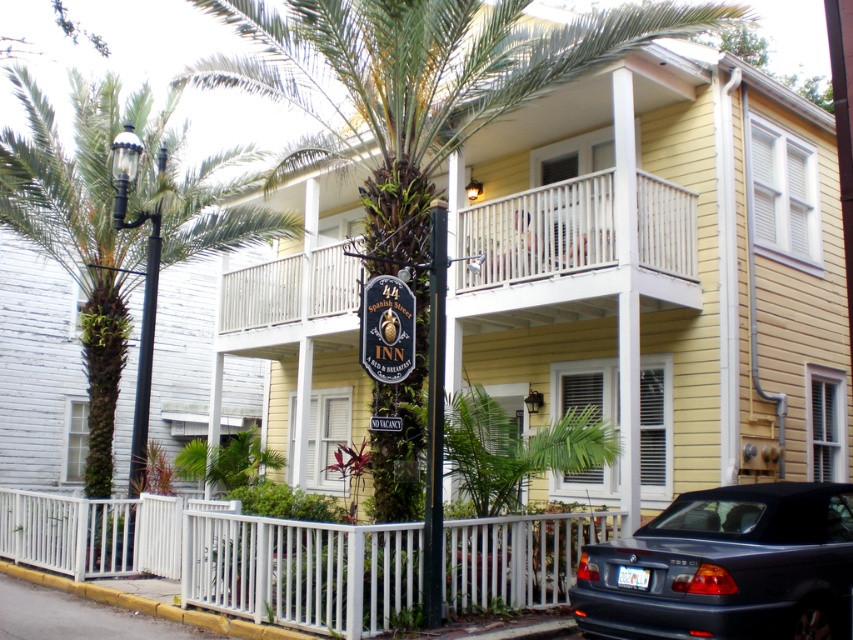
You are a gardener standing in front of the two story building. You need to determine if the green leafy palm tree at left can fit through a doorway that is the same width as the white wooden balcony at upper center. Can it?

The green leafy palm tree at left is narrower than the white wooden balcony at upper center, so it can fit through the doorway.

You are standing in front of the two story building and want to take a photo. You notice two points marked in the scene. One is at point [13,74] and the other is at point [149,355]. Which point is closer to your camera?

Point [13,74] is further to the camera than point [149,355], so the point closer to the camera is point [149,355].

You are standing in front of the two story building and want to take a photo of the green leafy palm tree at left. Where exactly should you position yourself to capture it in the frame?

To capture the green leafy palm tree at left in your photo, position yourself so that the camera is aligned with the coordinates provided at point 0.364 on the x axis and 0.138 on the y axis relative to the scene.